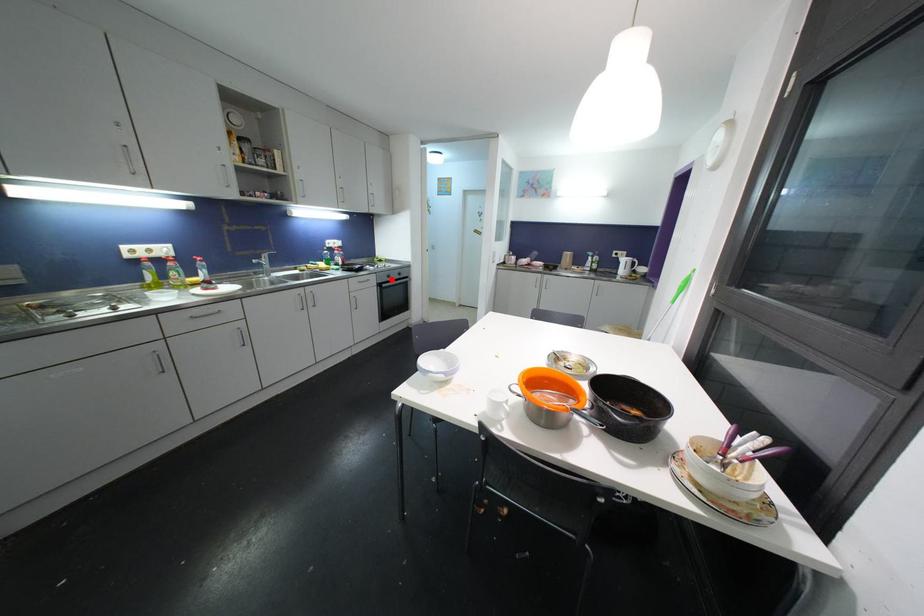
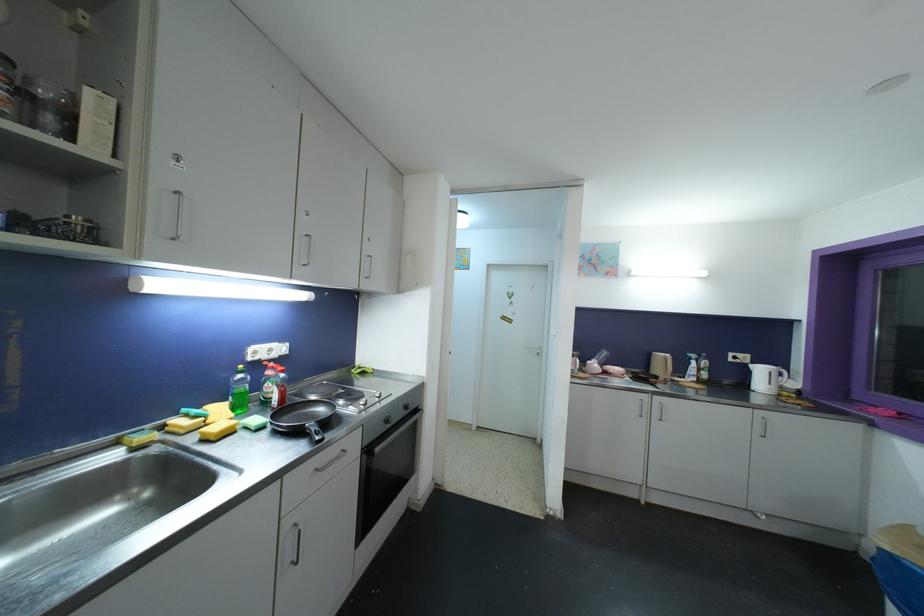
The point at the highlighted location is marked in the first image. Where is the corresponding point in the second image?

(390, 424)